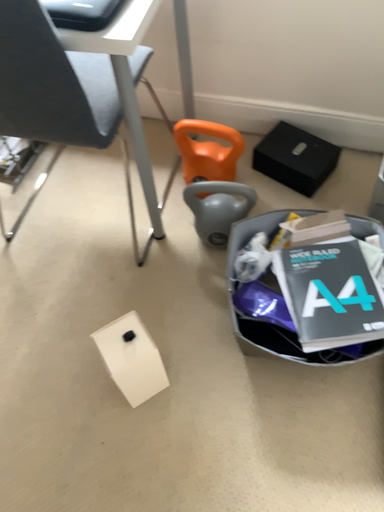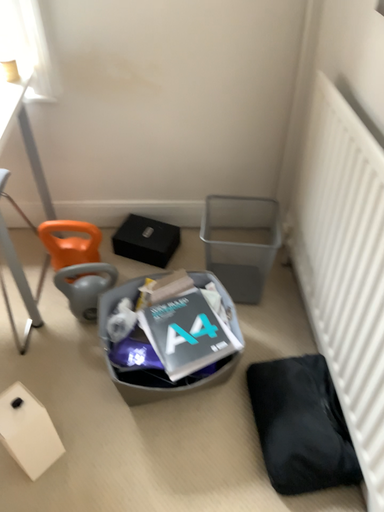
Question: Which way did the camera rotate in the video?

Choices:
 (A) rotated right
 (B) rotated left

Answer: (A)